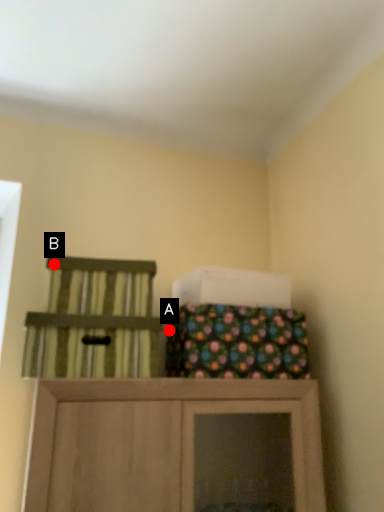
Question: Two points are circled on the image, labeled by A and B beside each circle. Which of the following is the closest to the observer?

Choices:
 (A) A is closer
 (B) B is closer

Answer: (B)